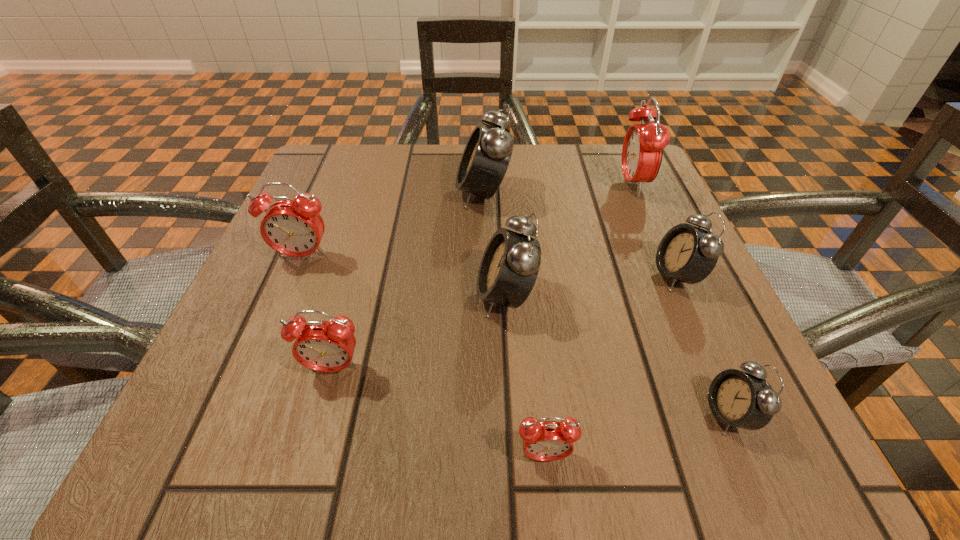
Find the location of a particular element. vacant area situated 0.060m on the face of the second biggest white alarm clock is located at coordinates (439, 296).

Locate an element on the screen. The image size is (960, 540). free space located 0.360m on the face of the second biggest white alarm clock is located at coordinates (250, 296).

Identify the location of free space located 0.120m on the face of the third smallest red alarm clock. (276, 320).

Where is `free space located 0.070m on the face of the second smallest white alarm clock`? The width and height of the screenshot is (960, 540). free space located 0.070m on the face of the second smallest white alarm clock is located at coordinates (612, 275).

The height and width of the screenshot is (540, 960). What are the coordinates of `free space located on the face of the second smallest white alarm clock` in the screenshot? It's located at (618, 275).

Find the location of a particular element. This screenshot has height=540, width=960. free point located 0.210m on the face of the second smallest white alarm clock is located at coordinates (528, 275).

The image size is (960, 540). I want to click on free space located 0.140m on the face of the seventh farthest object, so click(596, 414).

Identify the location of vacant space situated on the face of the seventh farthest object. (548, 414).

Where is `free region located 0.280m on the face of the seventh farthest object`? This screenshot has width=960, height=540. free region located 0.280m on the face of the seventh farthest object is located at coordinates (485, 414).

Identify the location of object present at the far right corner. This screenshot has width=960, height=540. (643, 145).